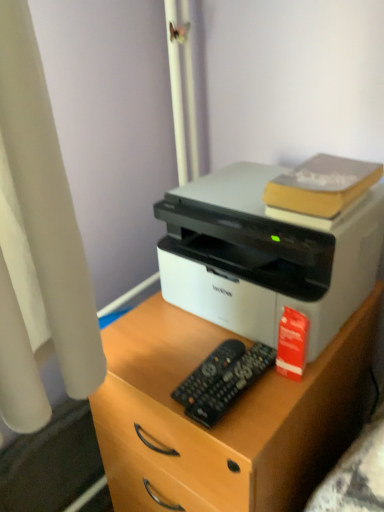
Locate an element on the screen. The width and height of the screenshot is (384, 512). vacant space to the left of white matte printer at center is located at coordinates (160, 342).